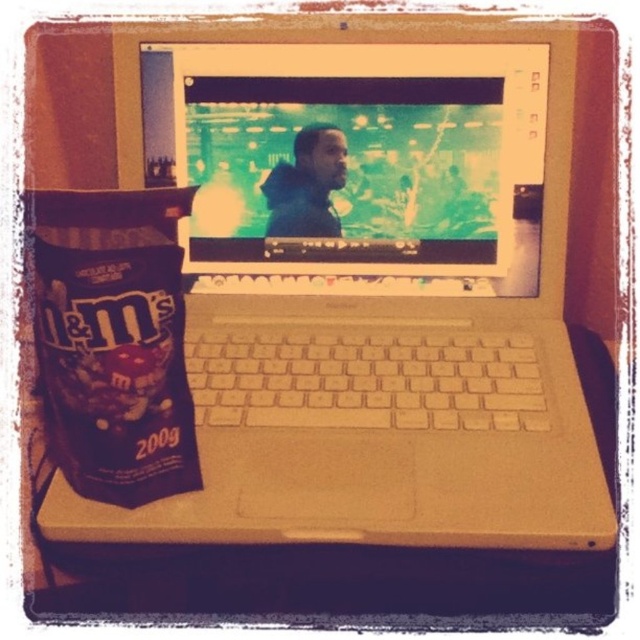
Which is more to the right, dark purple matte m&m's bag at left or matte plastic table at lower center?

Positioned to the right is matte plastic table at lower center.

Does point (77, 472) come behind point (36, 589)?

No, it is not.

Who is more forward, (42, 380) or (484, 579)?

Point (42, 380) is in front.

Locate an element on the screen. The width and height of the screenshot is (640, 640). dark purple matte m&m's bag at left is located at coordinates (113, 340).